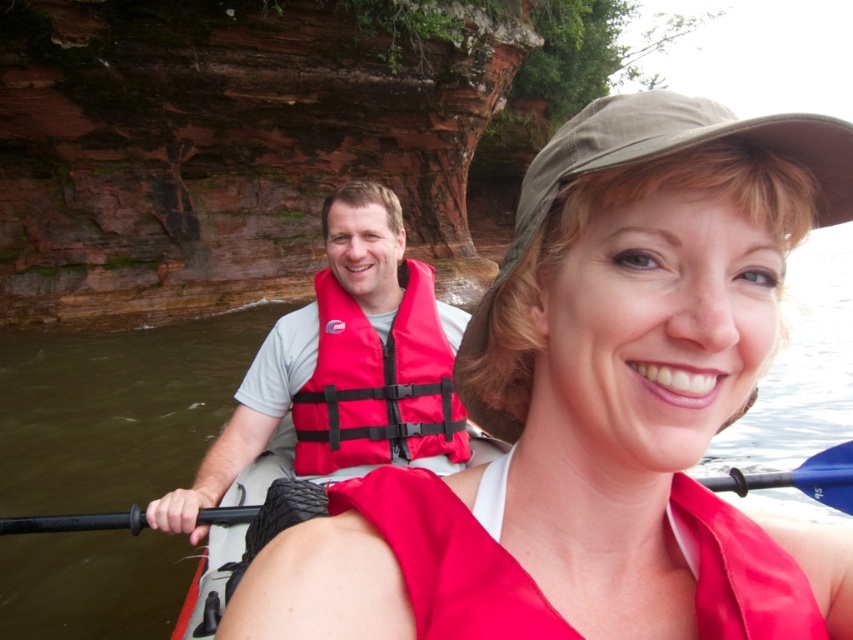
Question: Which object is the farthest from the red life vest at center?

Choices:
 (A) black rubber paddle at center
 (B) red matte life jacket at center
 (C) matte red life vest at center
 (D) red nylon life jacket at center

Answer: (C)

Question: Does red matte life jacket at center appear on the left side of red nylon life jacket at center?

Choices:
 (A) no
 (B) yes

Answer: (A)

Question: Is matte red life vest at center below red life vest at center?

Choices:
 (A) yes
 (B) no

Answer: (B)

Question: Estimate the real-world distances between objects in this image. Which object is farther from the red nylon life jacket at center?

Choices:
 (A) red matte life jacket at center
 (B) black rubber paddle at center

Answer: (A)

Question: Which object appears closest to the camera in this image?

Choices:
 (A) red matte life jacket at center
 (B) matte red life vest at center
 (C) black rubber paddle at center
 (D) red nylon life jacket at center

Answer: (A)

Question: Can you confirm if red matte life jacket at center is wider than red life vest at center?

Choices:
 (A) yes
 (B) no

Answer: (B)